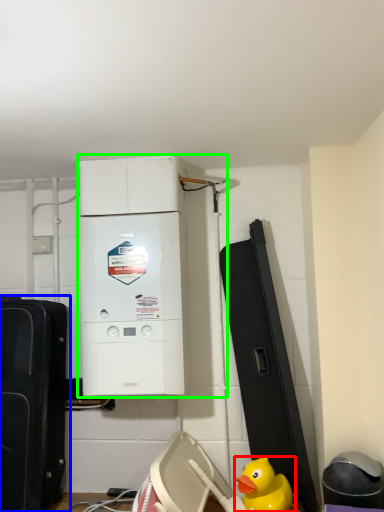
Question: Considering the real-world distances, which object is closest to duck (highlighted by a red box)? toy (highlighted by a blue box) or home appliance (highlighted by a green box).

Choices:
 (A) toy
 (B) home appliance

Answer: (B)